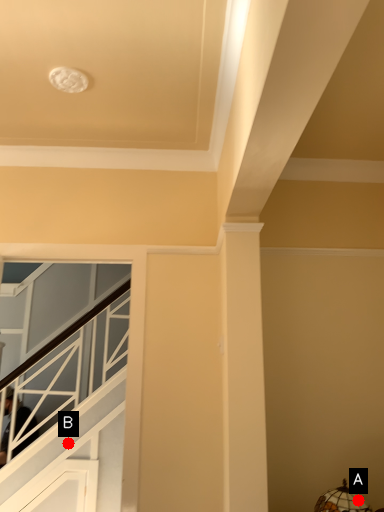
Question: Two points are circled on the image, labeled by A and B beside each circle. Which point appears closest to the camera in this image?

Choices:
 (A) A is closer
 (B) B is closer

Answer: (A)